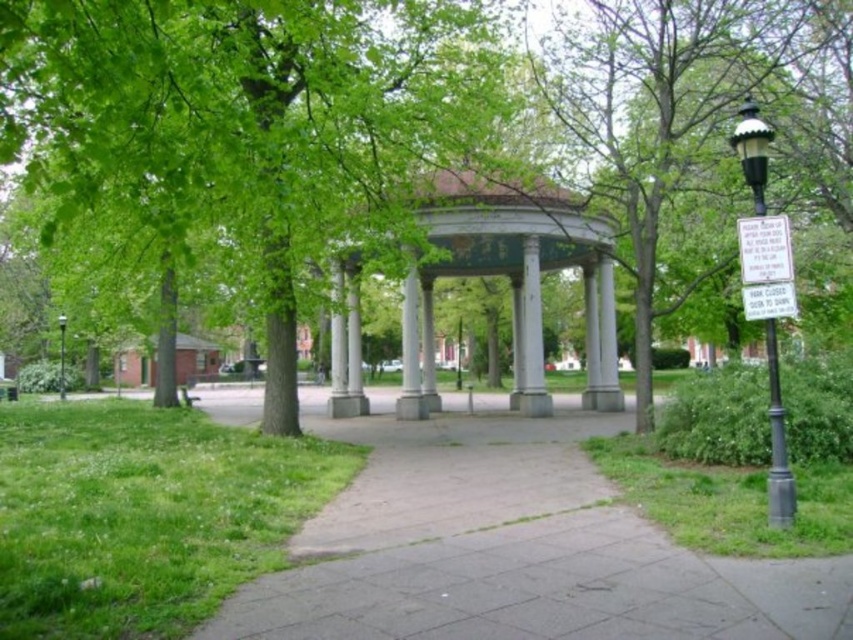
Is white marble column at center taller than black glass lamp post at left?

In fact, white marble column at center may be shorter than black glass lamp post at left.

This screenshot has height=640, width=853. What do you see at coordinates (410, 355) in the screenshot? I see `white marble column at center` at bounding box center [410, 355].

Is point (410, 275) in front of point (64, 323)?

Yes, it is.

You are a GUI agent. You are given a task and a screenshot of the screen. Output one action in this format:
    pyautogui.click(x=<x>, y=<y>)
    Task: Click on the white marble column at center
    Image resolution: width=853 pixels, height=640 pixels.
    Given the screenshot: What is the action you would take?
    pyautogui.click(x=410, y=355)

Is gray concrete pavement at center closer to the viewer compared to green grass at right?

That is True.

Identify the location of gray concrete pavement at center. Image resolution: width=853 pixels, height=640 pixels. (512, 547).

Measure the distance between point (424,288) and camera.

They are 29.33 meters apart.

Is white marble gazebo at center further to camera compared to white paper sign at right?

Yes, white marble gazebo at center is behind white paper sign at right.

Does point (439, 220) come closer to viewer compared to point (758, 227)?

No, (439, 220) is further to viewer.

At what (x,y) coordinates should I click in order to perform the action: click on white marble gazebo at center. Please return your answer as a coordinate pair (x, y). Image resolution: width=853 pixels, height=640 pixels. Looking at the image, I should click on (509, 280).